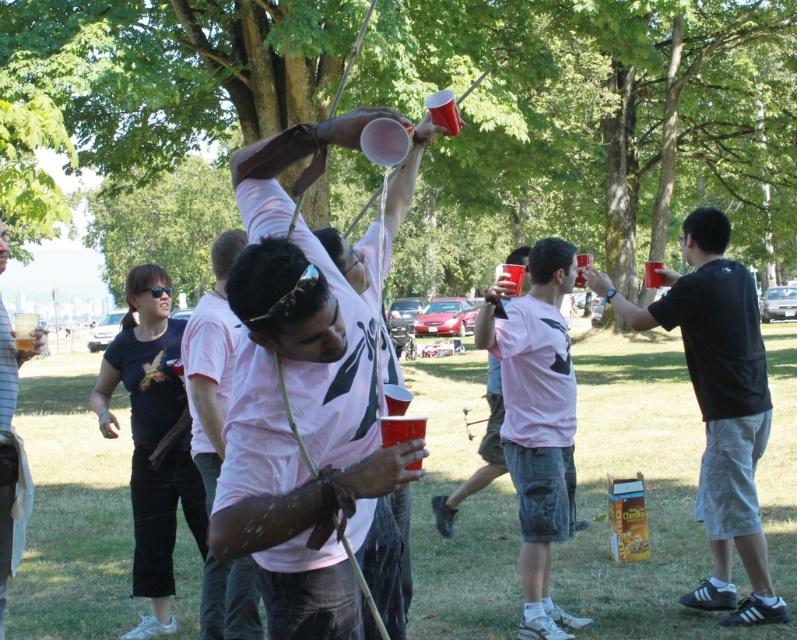
The width and height of the screenshot is (797, 640). What do you see at coordinates (536, 420) in the screenshot?
I see `matte pink t-shirt at center` at bounding box center [536, 420].

Can you confirm if matte pink t-shirt at center is positioned below pink matte t-shirt at center?

Yes.

Where is `matte pink t-shirt at center`? Image resolution: width=797 pixels, height=640 pixels. matte pink t-shirt at center is located at coordinates (536, 420).

Is matte pink shirt at center thinner than black matte shirt at right?

Yes.

Who is more distant from viewer, (328,564) or (748,449)?

Point (748,449)

Who is more distant from viewer, [242,381] or [703,314]?

The point [703,314] is more distant.

I want to click on matte pink shirt at center, so click(300, 403).

Is matte pink shirt at center closer to camera compared to matte black t-shirt at center?

Yes, matte pink shirt at center is in front of matte black t-shirt at center.

Which is in front, point (234, 516) or point (2, 582)?

Positioned in front is point (234, 516).

The width and height of the screenshot is (797, 640). In order to click on matte pink shirt at center in this screenshot , I will do `click(300, 403)`.